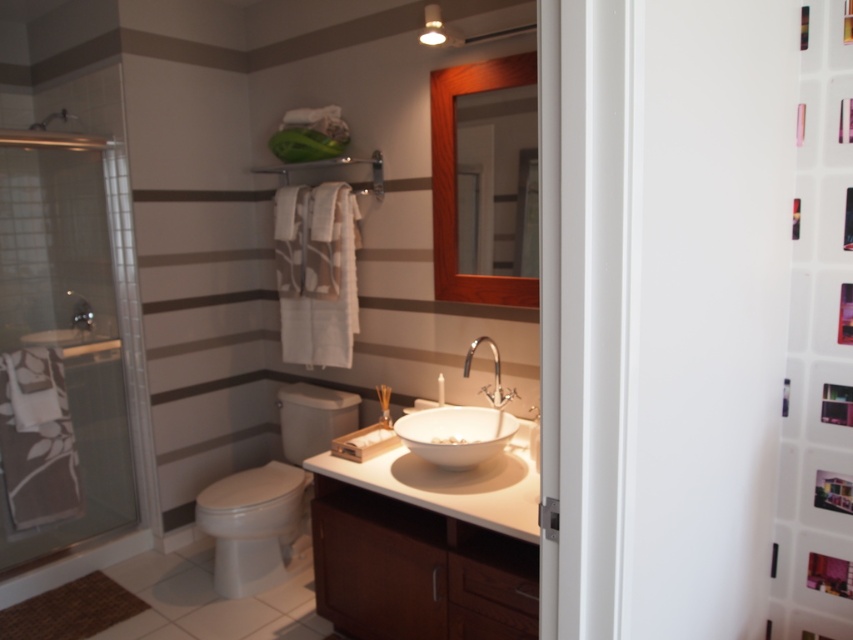
You are standing in the bathroom and need to reach the white glossy toilet at center. According to the room layout, where should you head towards?

The white glossy toilet at center is located at point (x=270, y=492), so you should head towards the center of the bathroom to reach it.

You are a plumber trying to fix the polished chrome faucet at center. You need to reach it while standing in front of the white glossy toilet at center. Is there enough space between them for you to work comfortably?

The distance between the white glossy toilet at center and the polished chrome faucet at center is 37.56 inches, which is more than enough space for a plumber to comfortably work on the faucet.